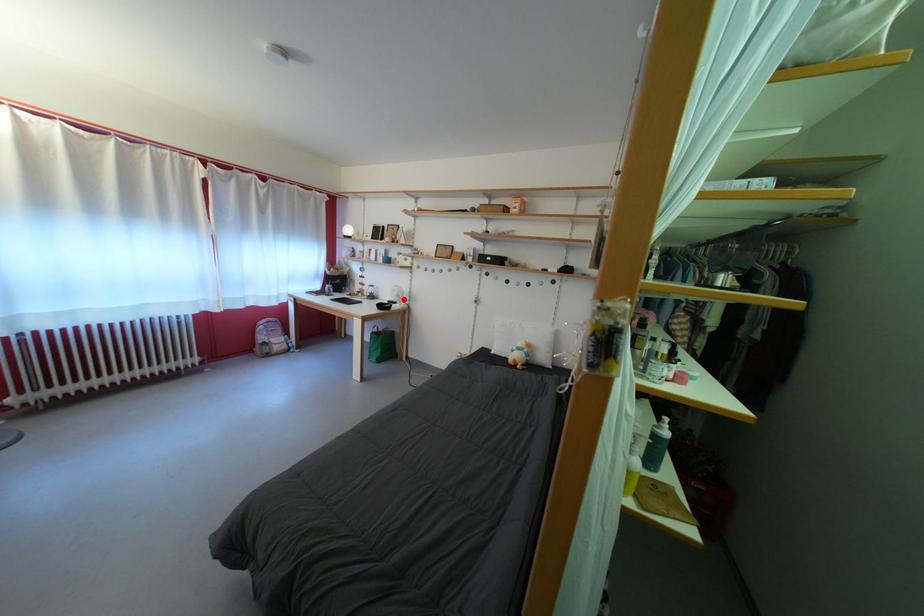
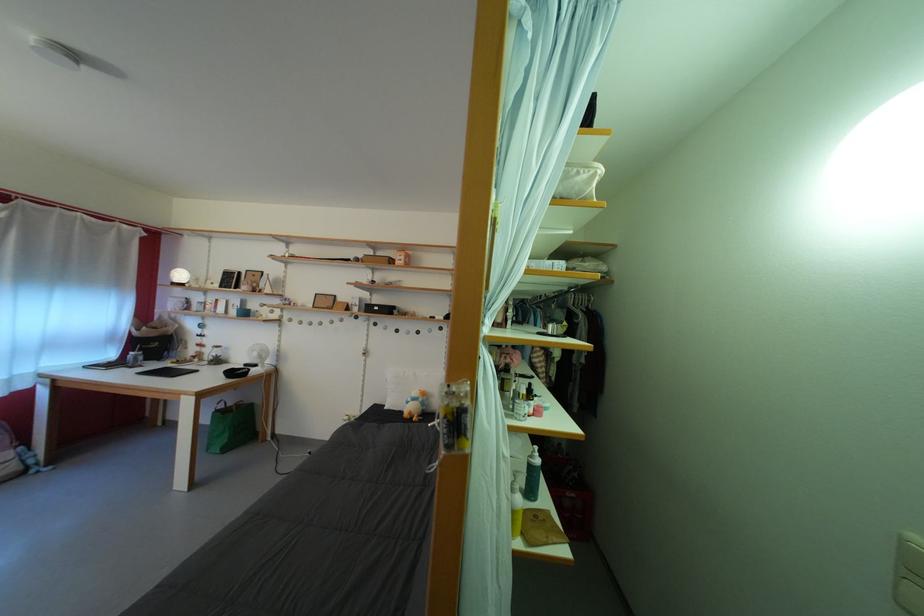
In the second image, find the point that corresponds to the highlighted location in the first image.

(263, 360)